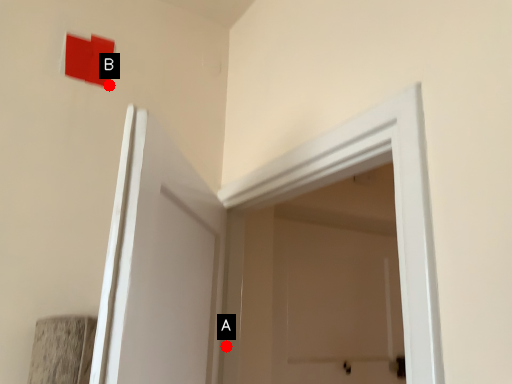
Question: Two points are circled on the image, labeled by A and B beside each circle. Which of the following is the farthest from the observer?

Choices:
 (A) A is further
 (B) B is further

Answer: (B)